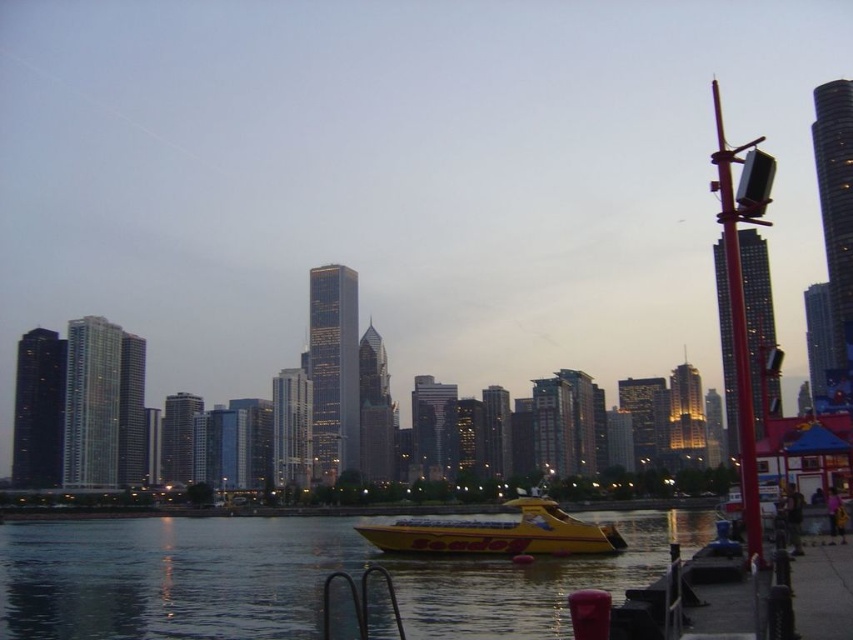
Who is more forward, (123,556) or (569,552)?

Point (569,552)

Between transparent water at center and yellow matte seadog at center, which one has more height?

yellow matte seadog at center is taller.

The image size is (853, 640). What are the coordinates of `transparent water at center` in the screenshot? It's located at (294, 577).

Locate an element on the screen. The image size is (853, 640). transparent water at center is located at coordinates (294, 577).